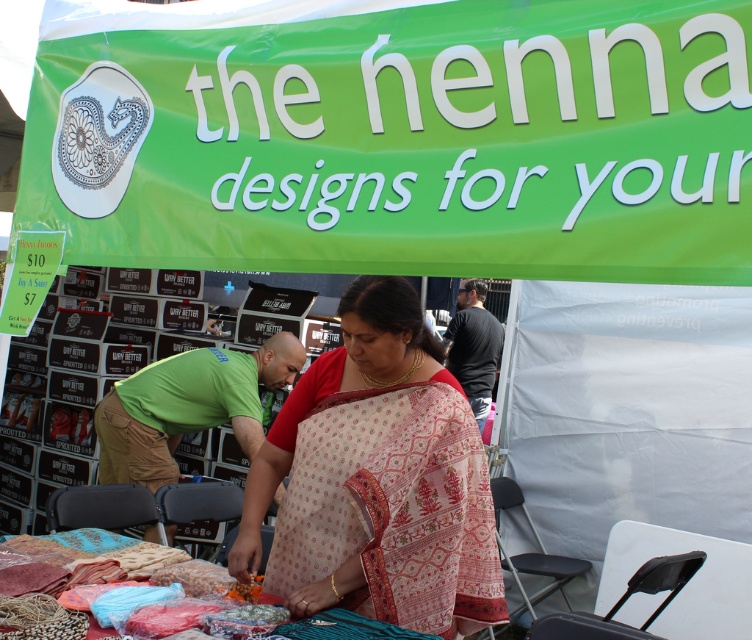
Between patterned silk saree at center and textured fabric at center, which one has less height?

textured fabric at center

Does patterned silk saree at center have a greater width compared to textured fabric at center?

In fact, patterned silk saree at center might be narrower than textured fabric at center.

Describe the element at coordinates (378, 480) in the screenshot. I see `patterned silk saree at center` at that location.

This screenshot has width=752, height=640. Find the location of `patterned silk saree at center`. patterned silk saree at center is located at coordinates (378, 480).